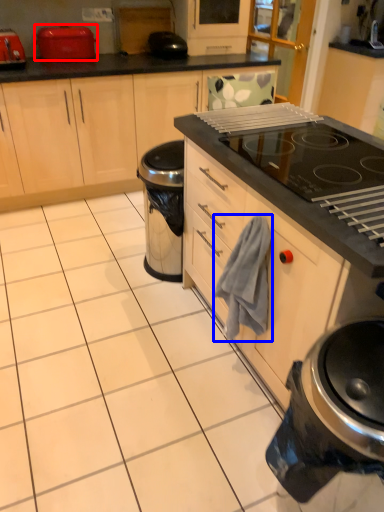
Question: Which of the following is the farthest to the observer, kitchen appliance (highlighted by a red box) or hand towel (highlighted by a blue box)?

Choices:
 (A) kitchen appliance
 (B) hand towel

Answer: (A)